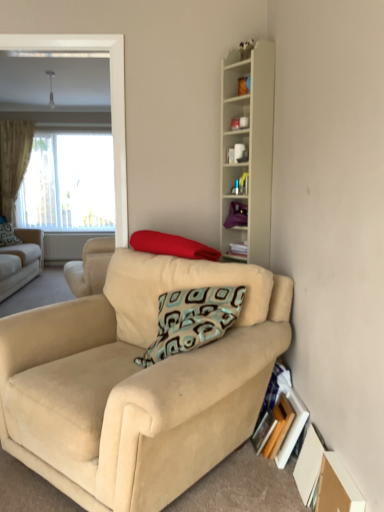
Question: Is brown cardboard box at lower right not within beige fabric couch at left, which is the 1th studio couch from left to right?

Choices:
 (A) no
 (B) yes

Answer: (B)

Question: From the image's perspective, does brown cardboard box at lower right appear higher than beige fabric couch at left, which ranks as the first studio couch in back-to-front order?

Choices:
 (A) no
 (B) yes

Answer: (A)

Question: Are brown cardboard box at lower right and beige fabric couch at left, which is counted as the 2th studio couch, starting from the front, far apart?

Choices:
 (A) no
 (B) yes

Answer: (B)

Question: Is brown cardboard box at lower right facing away from beige fabric couch at left, marked as the 2th studio couch in a right-to-left arrangement?

Choices:
 (A) yes
 (B) no

Answer: (B)

Question: From the image's perspective, is brown cardboard box at lower right below beige fabric couch at left, which ranks as the first studio couch in back-to-front order?

Choices:
 (A) yes
 (B) no

Answer: (A)

Question: From their relative heights in the image, would you say red fabric pillow at center, which is the 2th pillow in top-to-bottom order, is taller or shorter than beige fabric couch at left, marked as the 2th studio couch in a right-to-left arrangement?

Choices:
 (A) tall
 (B) short

Answer: (B)

Question: Relative to beige fabric couch at left, marked as the 2th studio couch in a right-to-left arrangement, is red fabric pillow at center, which is the 2th pillow in top-to-bottom order, in front or behind?

Choices:
 (A) behind
 (B) front

Answer: (B)

Question: Does point (150, 237) appear closer or farther from the camera than point (34, 234)?

Choices:
 (A) farther
 (B) closer

Answer: (B)

Question: From the image's perspective, relative to beige fabric couch at left, which is counted as the 2th studio couch, starting from the front, is red fabric pillow at center, the 2th pillow from the left, above or below?

Choices:
 (A) above
 (B) below

Answer: (A)

Question: Is point (144, 247) positioned closer to the camera than point (165, 450)?

Choices:
 (A) farther
 (B) closer

Answer: (A)

Question: Based on their positions, is red fabric pillow at center, the 1th pillow positioned from the front, located to the left or right of beige suede studio couch at center, marked as the second studio couch in a left-to-right arrangement?

Choices:
 (A) right
 (B) left

Answer: (A)

Question: Choose the correct answer: Is red fabric pillow at center, which ranks as the first pillow in bottom-to-top order, inside beige suede studio couch at center, arranged as the first studio couch when viewed from the right, or outside it?

Choices:
 (A) inside
 (B) outside

Answer: (A)

Question: Is red fabric pillow at center, which is the 2th pillow in top-to-bottom order, bigger or smaller than beige suede studio couch at center, which is the second studio couch in back-to-front order?

Choices:
 (A) small
 (B) big

Answer: (A)

Question: Considering their positions, is beige suede studio couch at center, arranged as the first studio couch when viewed from the right, located in front of or behind red fabric pillow at center, placed as the 1th pillow when sorted from right to left?

Choices:
 (A) behind
 (B) front

Answer: (B)

Question: Is beige suede studio couch at center, arranged as the first studio couch when viewed from the right, to the left or to the right of red fabric pillow at center, the 1th pillow positioned from the front, in the image?

Choices:
 (A) left
 (B) right

Answer: (A)